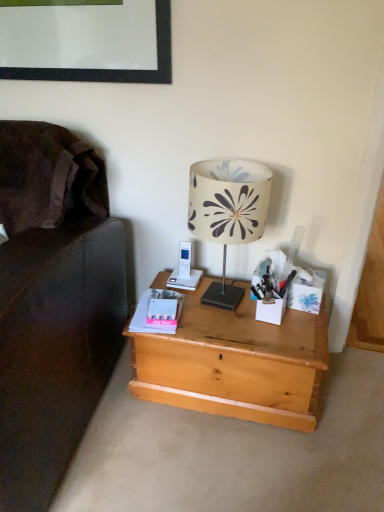
The width and height of the screenshot is (384, 512). Find the location of `vacant space that is to the left of white matte stationery at right`. vacant space that is to the left of white matte stationery at right is located at coordinates coord(229,318).